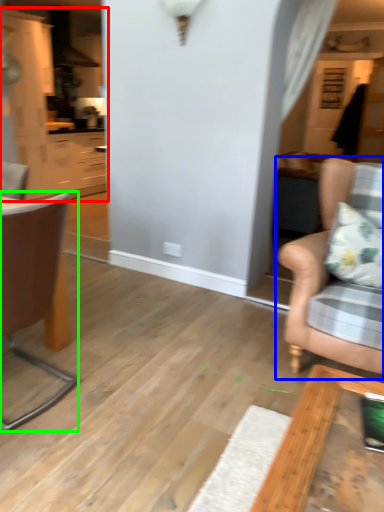
Question: Based on their relative distances, which object is farther from cabinetry (highlighted by a red box)? Choose from chair (highlighted by a blue box) and chair (highlighted by a green box).

Choices:
 (A) chair
 (B) chair

Answer: (A)